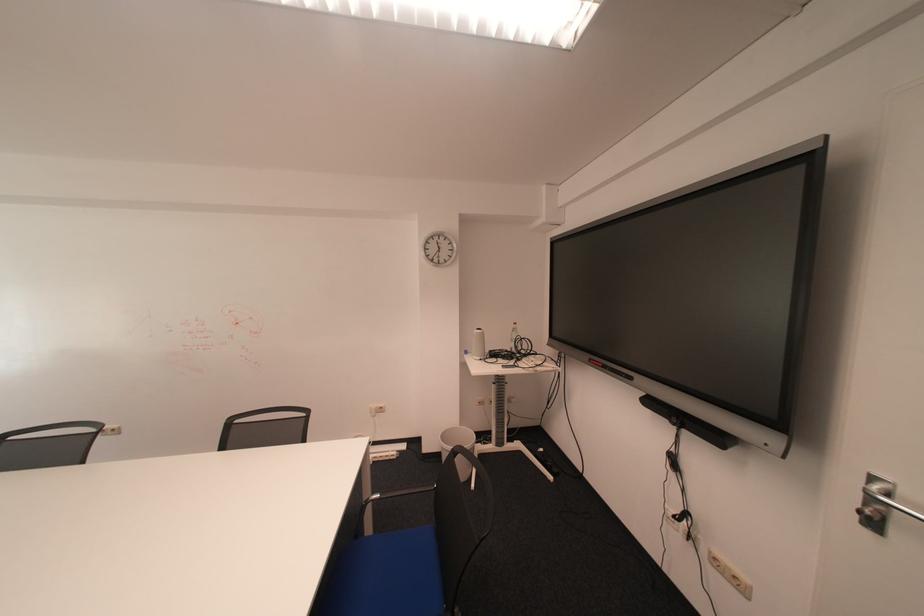
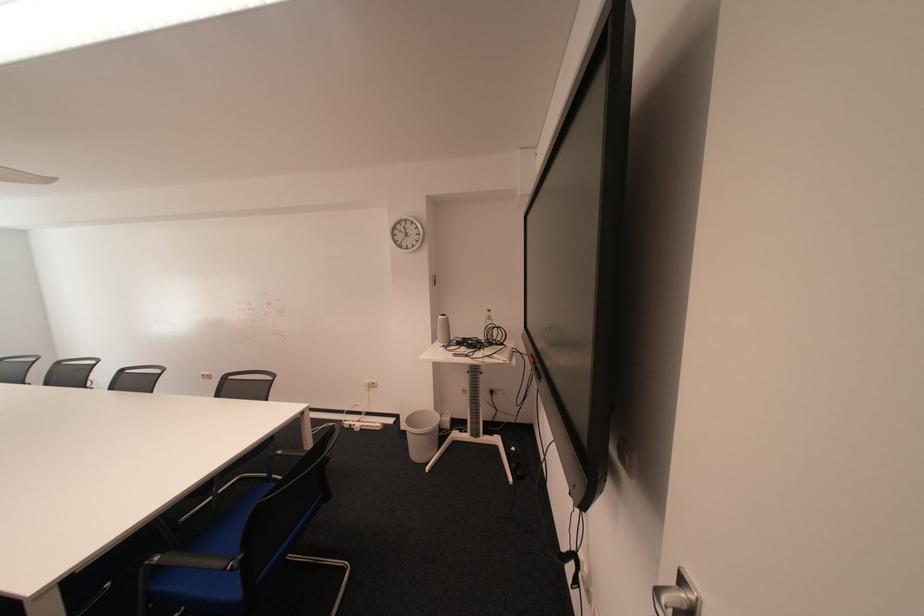
Question: The camera is either moving clockwise (left) or counter-clockwise (right) around the object. The first image is from the beginning of the video and the second image is from the end. Is the camera moving left or right when shooting the video?

Choices:
 (A) Left
 (B) Right

Answer: (B)